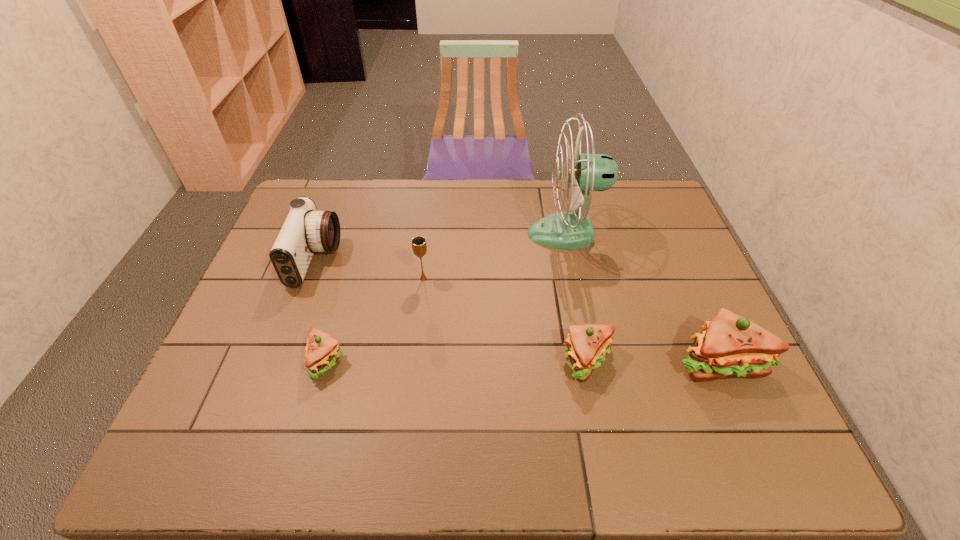
In the image, there is a desktop. Where is `free space at the far edge`? free space at the far edge is located at coordinates (355, 185).

The height and width of the screenshot is (540, 960). In the image, there is a desktop. What are the coordinates of `free space at the near edge` in the screenshot? It's located at (337, 384).

The image size is (960, 540). Identify the location of vacant space at the left edge. (244, 315).

The height and width of the screenshot is (540, 960). In the image, there is a desktop. Identify the location of vacant space at the right edge. (679, 254).

Where is `free region at the far left corner of the desktop`? This screenshot has height=540, width=960. free region at the far left corner of the desktop is located at coordinates (303, 194).

Where is `free space at the near left corner`? The width and height of the screenshot is (960, 540). free space at the near left corner is located at coordinates [x=236, y=415].

The image size is (960, 540). Identify the location of vacant space at the near right corner. (744, 386).

Where is `free space between the second tallest sandwich and the chalice`? This screenshot has height=540, width=960. free space between the second tallest sandwich and the chalice is located at coordinates (506, 320).

At what (x,y) coordinates should I click in order to perform the action: click on free space between the fan and the camcorder. Please return your answer as a coordinate pair (x, y). The image size is (960, 540). Looking at the image, I should click on (441, 247).

Image resolution: width=960 pixels, height=540 pixels. Find the location of `vacant area that lies between the shortest sandwich and the rightmost object`. vacant area that lies between the shortest sandwich and the rightmost object is located at coordinates (522, 361).